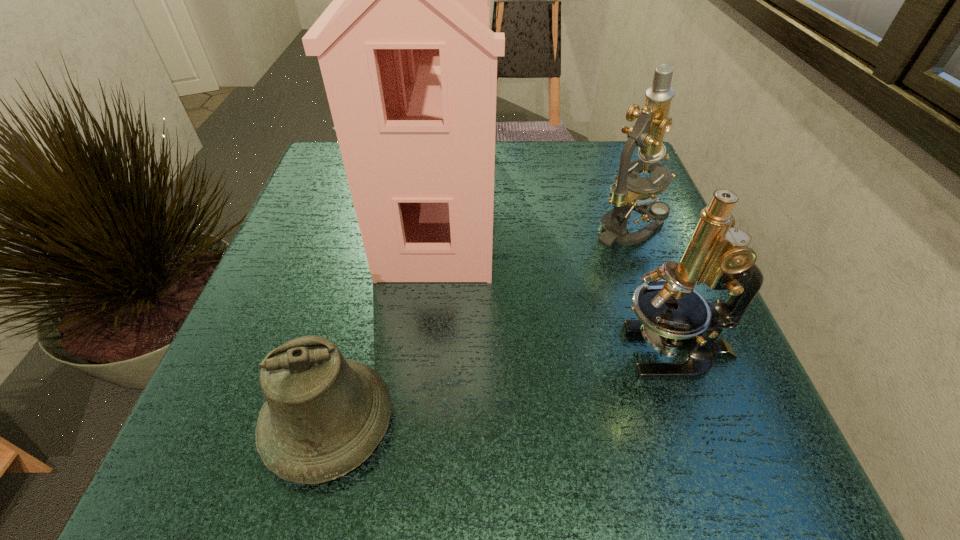
The width and height of the screenshot is (960, 540). In order to click on blank space at the near right corner in this screenshot , I will do `click(700, 480)`.

Identify the location of empty space between the bell and the farther microscope. (478, 325).

Identify the location of unoccupied area between the farther microscope and the shortest object. Image resolution: width=960 pixels, height=540 pixels. (478, 325).

The height and width of the screenshot is (540, 960). I want to click on free point between the nearer microscope and the tallest object, so click(x=557, y=276).

You are a GUI agent. You are given a task and a screenshot of the screen. Output one action in this format:
    pyautogui.click(x=<x>, y=<y>)
    Task: Click on the free point between the farther microscope and the shortest object
    
    Given the screenshot: What is the action you would take?
    pyautogui.click(x=478, y=325)

I want to click on empty space between the farther microscope and the dollhouse, so click(x=534, y=214).

This screenshot has width=960, height=540. I want to click on vacant area that lies between the farther microscope and the shortest object, so click(x=478, y=325).

Image resolution: width=960 pixels, height=540 pixels. I want to click on free space between the shortest object and the farther microscope, so click(478, 325).

Where is `vacant area between the shortest object and the farther microscope`? This screenshot has width=960, height=540. vacant area between the shortest object and the farther microscope is located at coordinates (478, 325).

Image resolution: width=960 pixels, height=540 pixels. I want to click on free space between the shortest object and the farther microscope, so click(x=478, y=325).